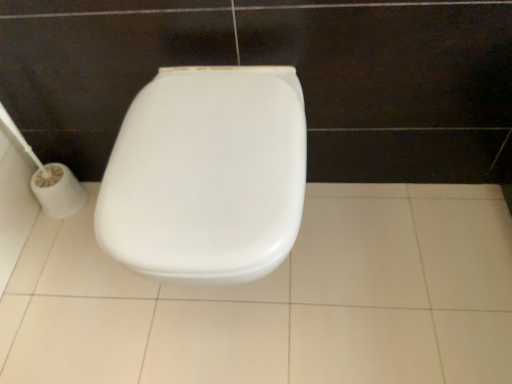
The image size is (512, 384). I want to click on free space underneath white plastic toilet at center (from a real-world perspective), so click(228, 306).